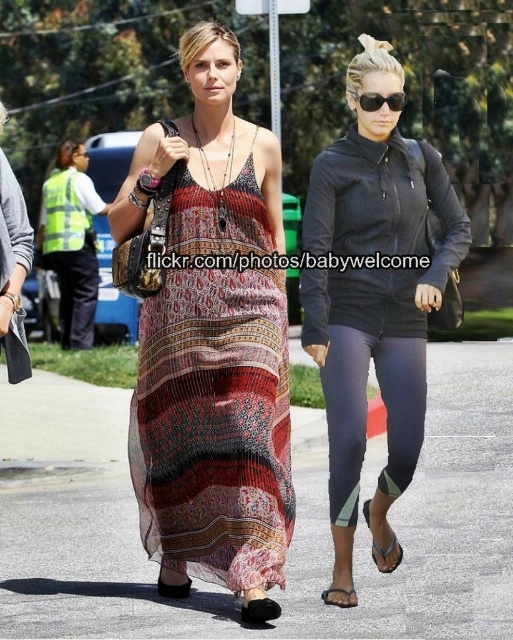
Who is positioned more to the left, printed chiffon maxi dress at center or black plastic sunglasses at upper center?

printed chiffon maxi dress at center

Between printed chiffon maxi dress at center and black plastic sunglasses at upper center, which one has less height?

Standing shorter between the two is black plastic sunglasses at upper center.

At what (x,y) coordinates should I click in order to perform the action: click on printed chiffon maxi dress at center. Please return your answer as a coordinate pair (x, y). This screenshot has height=640, width=513. Looking at the image, I should click on [x=374, y=298].

Locate an element on the screen. The height and width of the screenshot is (640, 513). printed chiffon maxi dress at center is located at coordinates (374, 298).

Consider the image. Who is positioned more to the left, dark blue leggings at lower right or black plastic sunglasses at upper center?

Answer: From the viewer's perspective, dark blue leggings at lower right appears more on the left side.

Does point (404, 406) come behind point (378, 93)?

No, it is not.

Locate an element on the screen. dark blue leggings at lower right is located at coordinates (365, 412).

What do you see at coordinates (214, 392) in the screenshot?
I see `printed chiffon dress at center` at bounding box center [214, 392].

Which of these two, printed chiffon dress at center or printed chiffon maxi dress at center, stands shorter?

printed chiffon dress at center is shorter.

Which is behind, point (169, 355) or point (453, 221)?

Point (169, 355)

Locate an element on the screen. The image size is (513, 640). printed chiffon dress at center is located at coordinates (214, 392).